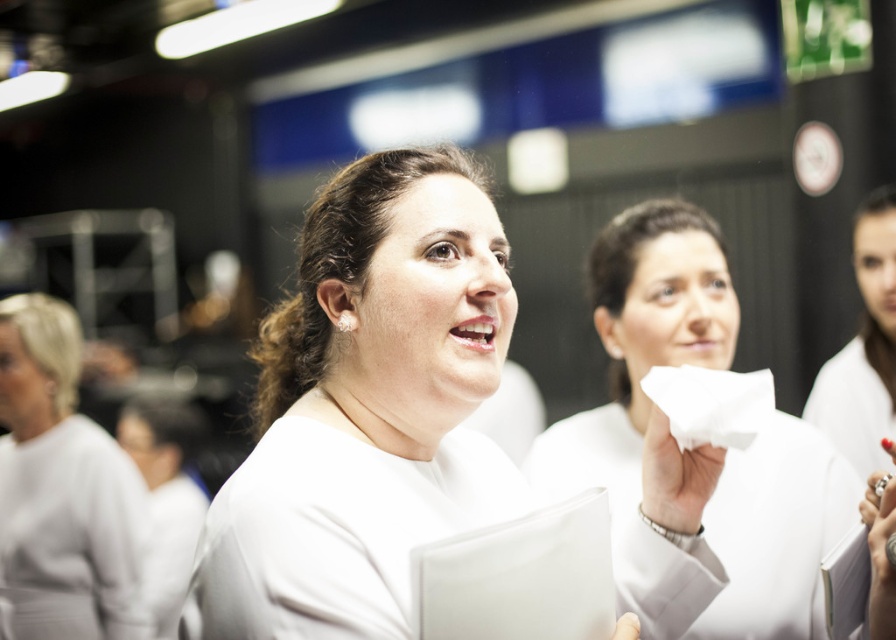
Is white matte sweater at center wider than white matte uniform at upper right?

Yes.

Identify the location of white matte sweater at center. (65, 474).

Who is taller, white matte paper towel at center or white matte sweater at center?

white matte sweater at center is taller.

Does white matte paper towel at center come in front of white matte sweater at center?

That is True.

This screenshot has width=896, height=640. I want to click on white matte paper towel at center, so click(642, 339).

Is white matte uniform at center above white matte sweater at center?

Yes.

Does white matte uniform at center appear on the right side of white matte sweater at center?

Correct, you'll find white matte uniform at center to the right of white matte sweater at center.

Between point (274, 349) and point (98, 449), which one is positioned behind?

The point (98, 449) is behind.

Locate an element on the screen. The image size is (896, 640). white matte uniform at center is located at coordinates coord(368,406).